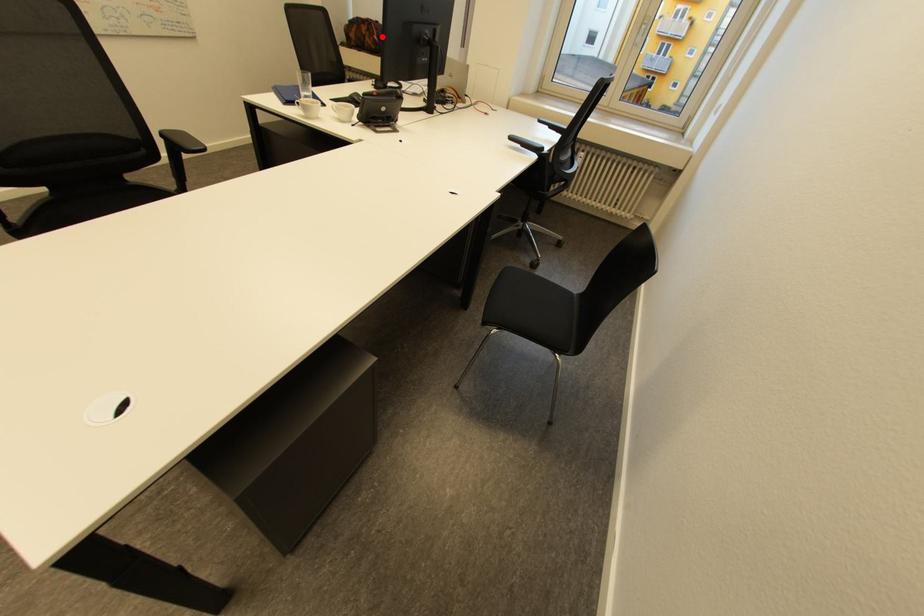
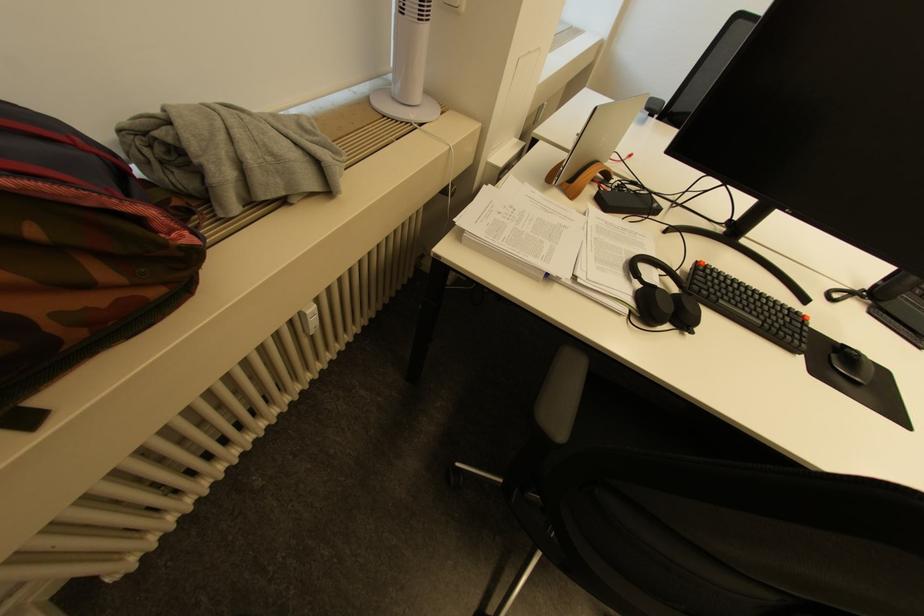
Where in the second image is the point corresponding to the highlighted location from the first image?

(196, 238)